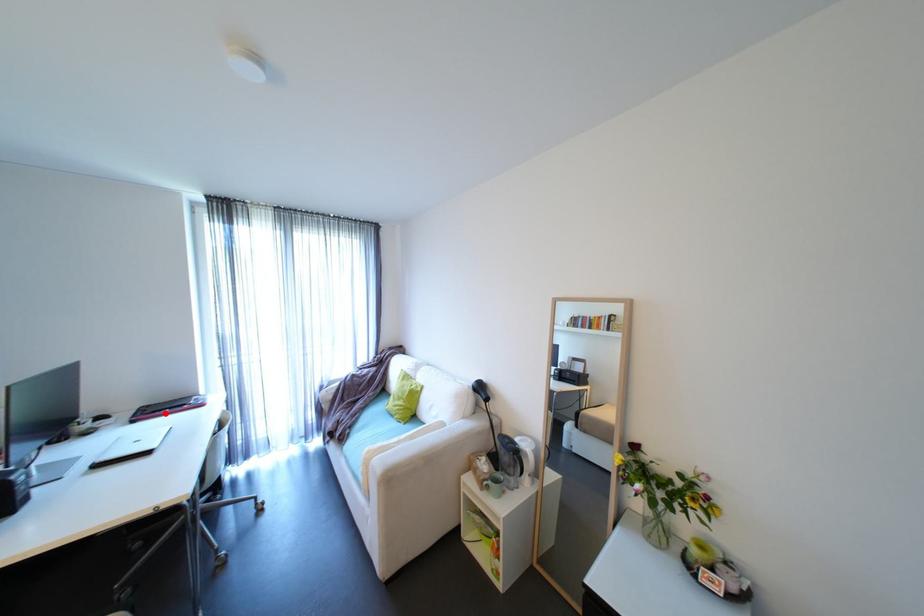
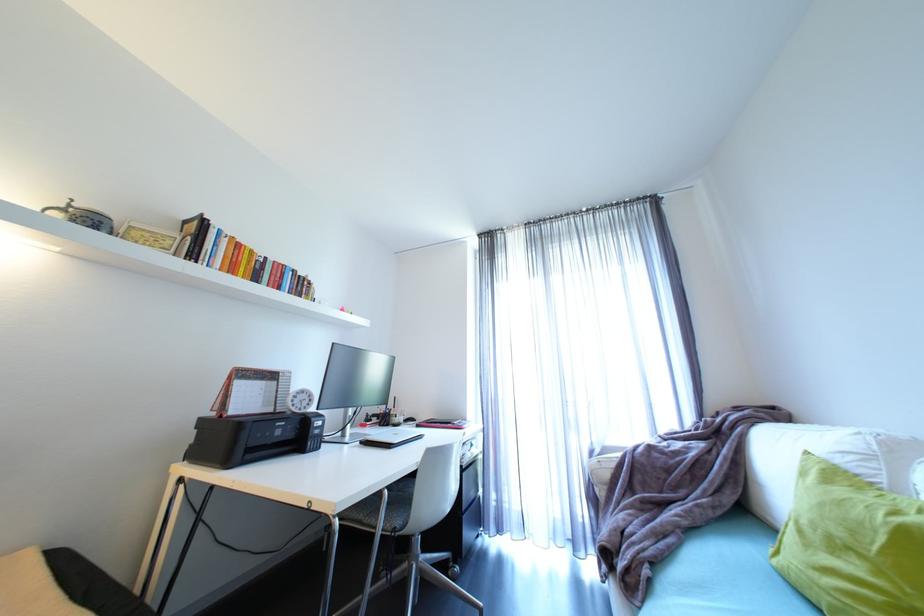
Where in the second image is the point corresponding to the highlighted location from the first image?

(440, 424)